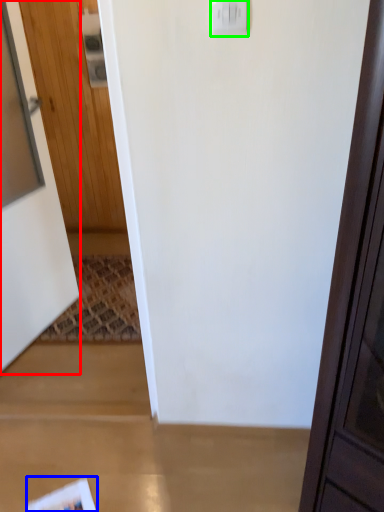
Question: Which is nearer to the door (highlighted by a red box)? magazine (highlighted by a blue box) or light switch (highlighted by a green box).

Choices:
 (A) magazine
 (B) light switch

Answer: (A)